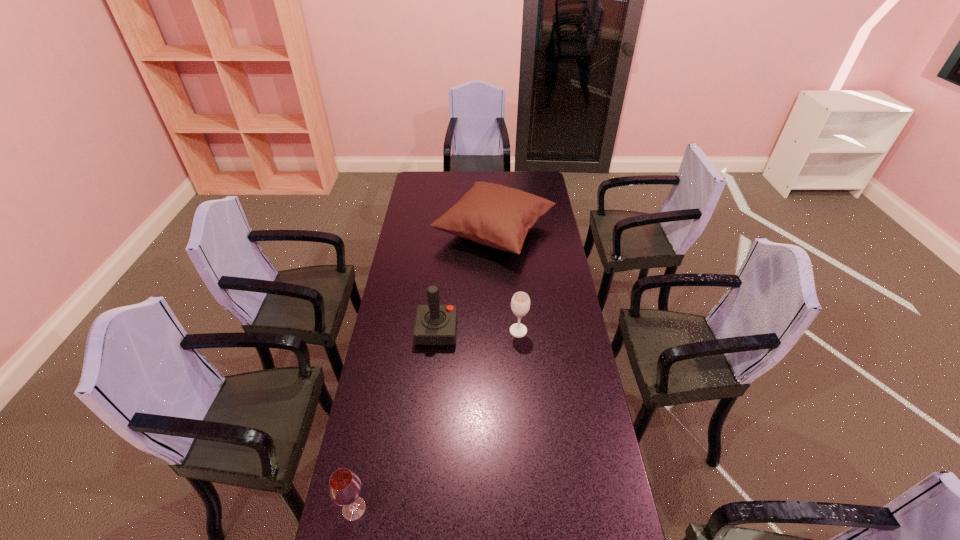
Locate an element on the screen. joystick is located at coordinates (435, 324).

I want to click on cushion, so click(493, 215).

Identify the location of the farther wineglass. This screenshot has height=540, width=960. (520, 303).

At what (x,y) coordinates should I click in order to perform the action: click on the leftmost object. Please return your answer as a coordinate pair (x, y). Looking at the image, I should click on (345, 486).

I want to click on the nearer wineglass, so click(x=345, y=486).

The width and height of the screenshot is (960, 540). Find the location of `vacant space situated on the base of the joystick`. vacant space situated on the base of the joystick is located at coordinates (511, 331).

The width and height of the screenshot is (960, 540). I want to click on vacant space positioned on the left of the cushion, so click(401, 231).

Image resolution: width=960 pixels, height=540 pixels. In order to click on vacant space situated 0.350m on the back of the farther wineglass in this screenshot , I will do `click(513, 267)`.

At what (x,y) coordinates should I click in order to perform the action: click on vacant area located on the right of the leftmost object. Please return your answer as a coordinate pair (x, y). Looking at the image, I should click on (440, 508).

Identify the location of joystick at the left edge. The width and height of the screenshot is (960, 540). (435, 324).